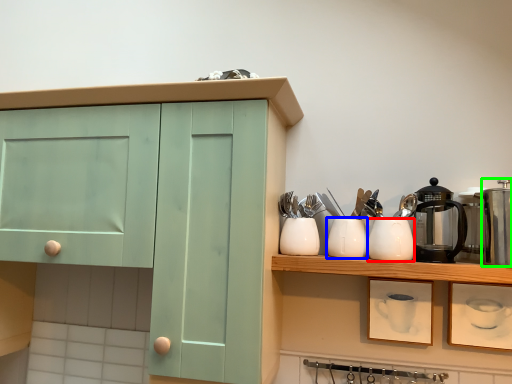
Question: Considering the real-world distances, which object is farthest from appliance (highlighted by a red box)? tableware (highlighted by a blue box) or appliance (highlighted by a green box)?

Choices:
 (A) tableware
 (B) appliance

Answer: (B)